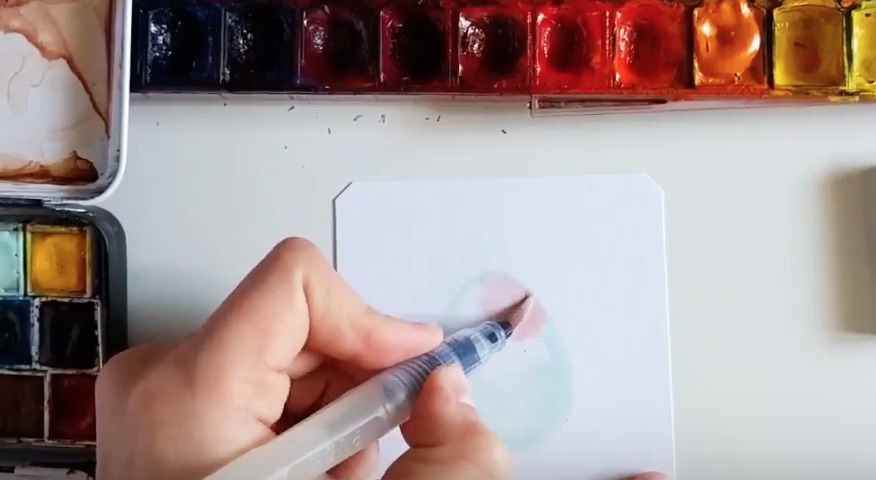
You are a GUI agent. You are given a task and a screenshot of the screen. Output one action in this format:
    pyautogui.click(x=<x>, y=<y>)
    Task: Click on the navy blue paint
    
    Given the screenshot: What is the action you would take?
    pyautogui.click(x=193, y=72)